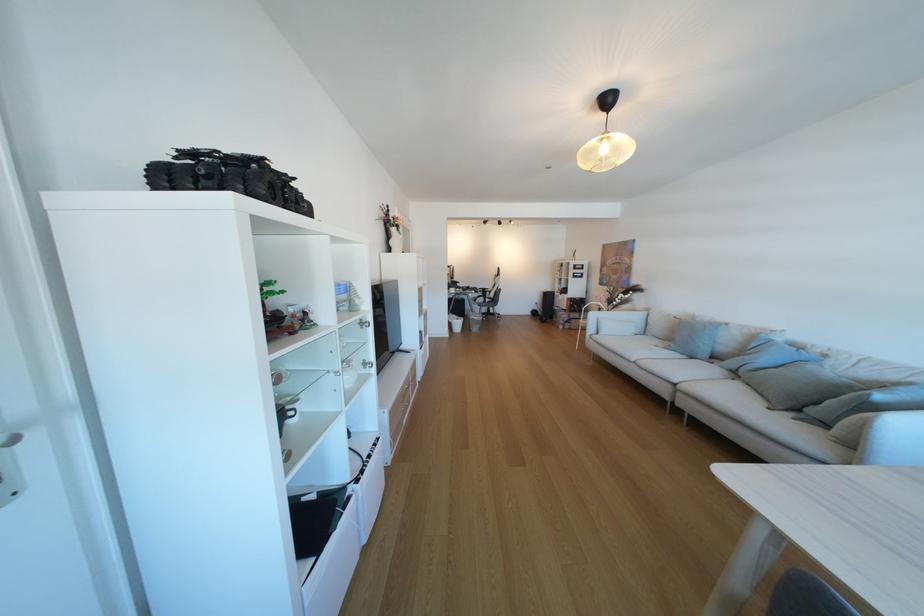
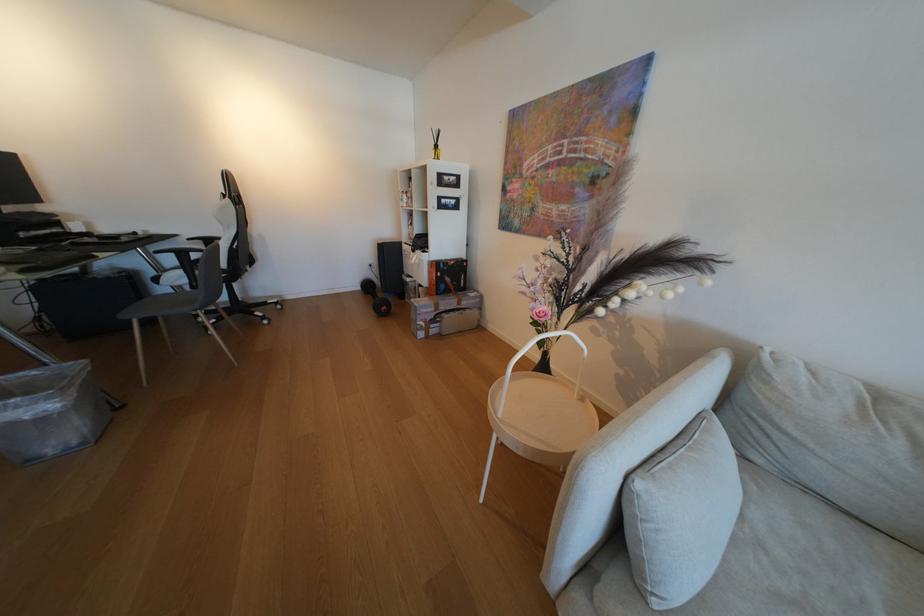
Find the pixel in the second image that matches (x=493, y=302) in the first image.

(196, 282)